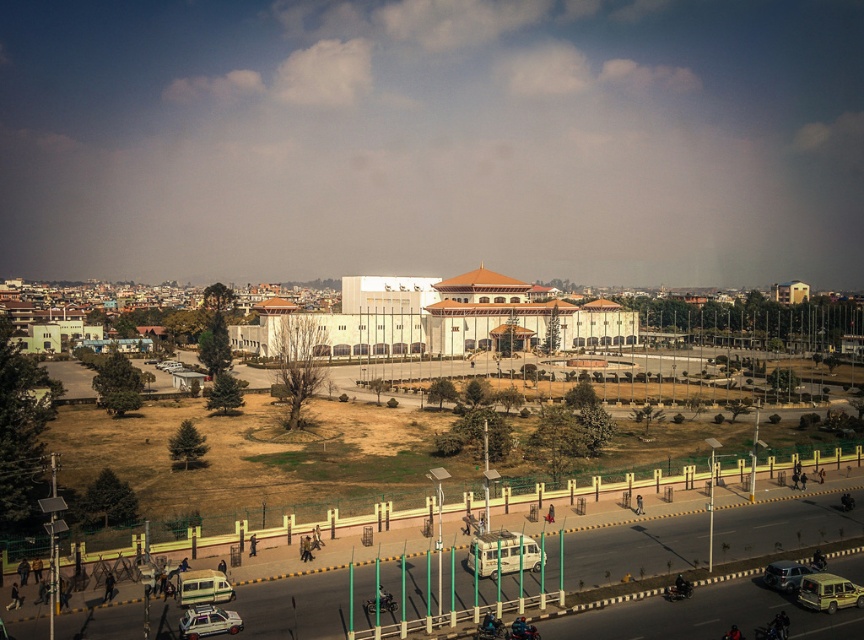
Question: From the image, what is the correct spatial relationship of white matte car at lower left in relation to metallic silver car at lower right?

Choices:
 (A) left
 (B) right

Answer: (A)

Question: Which point is closer to the camera?

Choices:
 (A) (764, 573)
 (B) (272, 300)

Answer: (A)

Question: Among these points, which one is farthest from the camera?

Choices:
 (A) (824, 584)
 (B) (780, 572)

Answer: (B)

Question: Is beige matte van at center below metallic silver van at lower right?

Choices:
 (A) no
 (B) yes

Answer: (A)

Question: Is white glossy building at center below beige matte van at center?

Choices:
 (A) yes
 (B) no

Answer: (B)

Question: Which point appears farthest from the camera in this image?

Choices:
 (A) (516, 564)
 (B) (777, 576)
 (C) (211, 621)
 (D) (518, 332)

Answer: (D)